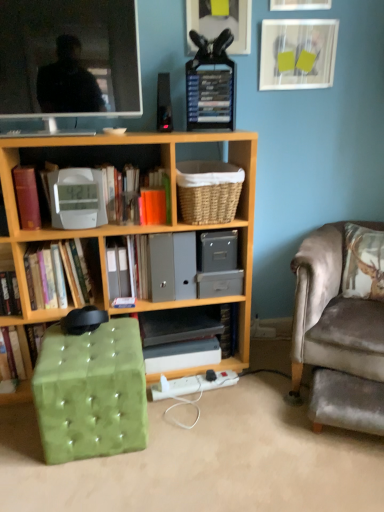
Find the location of a particular element. This screenshot has width=384, height=512. free space on the front side of wooden bookcase at center is located at coordinates (156, 464).